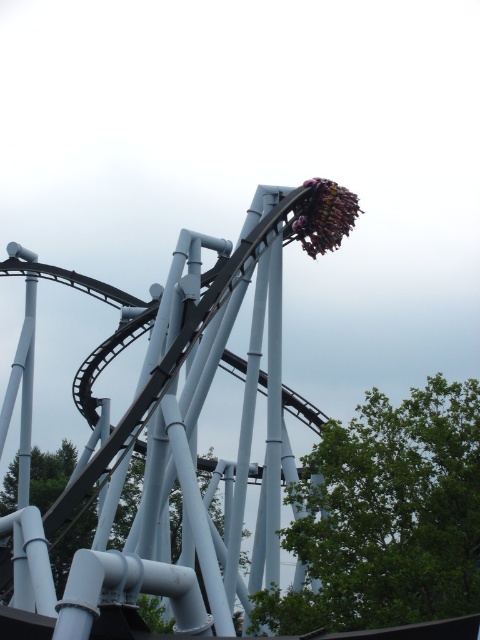
Question: Can you confirm if metal roller coaster at upper center is positioned above green matte tree at center?

Choices:
 (A) yes
 (B) no

Answer: (A)

Question: Which of the following is the closest to the observer?

Choices:
 (A) green matte tree at center
 (B) metal roller coaster at upper center

Answer: (B)

Question: Is green leafy tree at lower right above green matte tree at center?

Choices:
 (A) yes
 (B) no

Answer: (A)

Question: Which point is closer to the camera taking this photo?

Choices:
 (A) (72, 448)
 (B) (310, 230)

Answer: (B)

Question: Which object appears farthest from the camera in this image?

Choices:
 (A) green leafy tree at lower right
 (B) metal roller coaster at upper center
 (C) green matte tree at center

Answer: (C)

Question: Observing the image, what is the correct spatial positioning of metal roller coaster at upper center in reference to green leafy tree at lower right?

Choices:
 (A) below
 (B) above

Answer: (B)